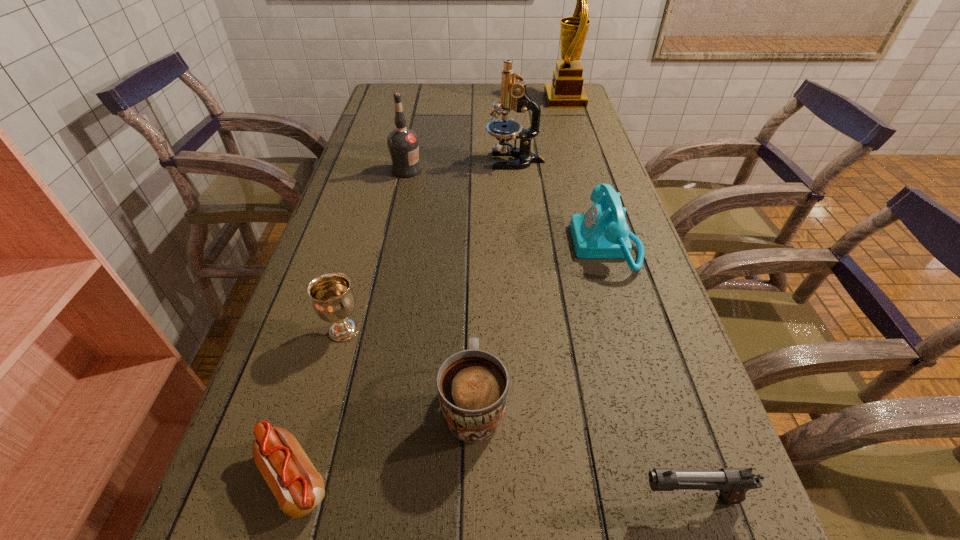
I want to click on the farthest object, so click(x=566, y=91).

Where is `award`? The height and width of the screenshot is (540, 960). award is located at coordinates (566, 91).

Where is `microscope`? The width and height of the screenshot is (960, 540). microscope is located at coordinates (514, 96).

Identify the location of the sixth shortest object. The height and width of the screenshot is (540, 960). (403, 143).

This screenshot has height=540, width=960. What are the coordinates of `telephone` in the screenshot? It's located at (602, 232).

Locate an element on the screen. The width and height of the screenshot is (960, 540). chalice is located at coordinates (333, 300).

Locate an element on the screen. The height and width of the screenshot is (540, 960). mug is located at coordinates [x=472, y=384].

This screenshot has height=540, width=960. I want to click on gun, so click(733, 483).

Where is `the shortest object`? The width and height of the screenshot is (960, 540). the shortest object is located at coordinates (298, 487).

The height and width of the screenshot is (540, 960). Find the location of `vacant position located 0.130m on the front-facing side of the award`. vacant position located 0.130m on the front-facing side of the award is located at coordinates (510, 100).